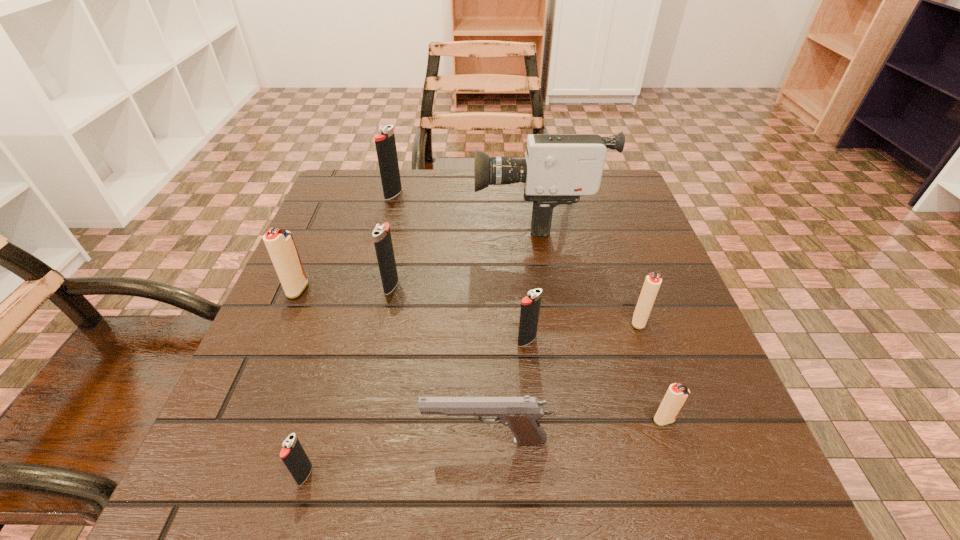
Identify the location of camcorder that is at the far edge. 559,168.

This screenshot has width=960, height=540. I want to click on igniter at the far edge, so click(385, 143).

The height and width of the screenshot is (540, 960). Identify the location of object positioned at the near edge. click(293, 455).

The height and width of the screenshot is (540, 960). Find the location of `camcorder at the right edge`. camcorder at the right edge is located at coordinates (559, 168).

I want to click on object that is at the far left corner, so click(385, 143).

Image resolution: width=960 pixels, height=540 pixels. I want to click on object that is at the near left corner, so click(x=293, y=455).

What are the coordinates of `object that is at the far right corner` in the screenshot? It's located at (559, 168).

What are the coordinates of `free space at the far edge of the desktop` in the screenshot? It's located at (520, 189).

Where is `vacant space at the near edge of the desktop`? This screenshot has width=960, height=540. vacant space at the near edge of the desktop is located at coordinates (448, 474).

What are the coordinates of `free space at the left edge of the desktop` in the screenshot? It's located at (294, 342).